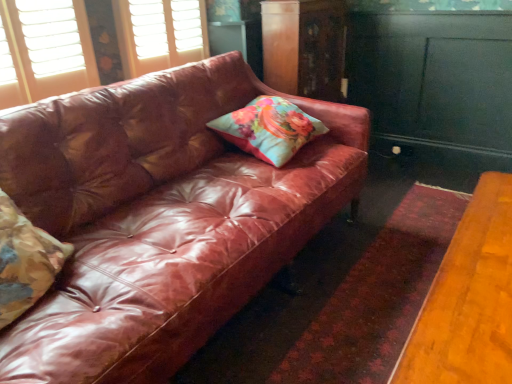
Question: Is floral fabric cushion at center, placed as the first pillow when sorted from top to bottom, surrounded by shiny brown leather couch at center?

Choices:
 (A) yes
 (B) no

Answer: (A)

Question: Considering the relative sizes of shiny brown leather couch at center and floral fabric cushion at center, acting as the 1th pillow starting from the back, in the image provided, is shiny brown leather couch at center thinner than floral fabric cushion at center, acting as the 1th pillow starting from the back,?

Choices:
 (A) no
 (B) yes

Answer: (A)

Question: Could you tell me if shiny brown leather couch at center is turned towards floral fabric cushion at center, placed as the 2th pillow when sorted from bottom to top?

Choices:
 (A) no
 (B) yes

Answer: (B)

Question: Can you confirm if shiny brown leather couch at center is positioned to the right of floral fabric cushion at center, placed as the 1th pillow when sorted from right to left?

Choices:
 (A) no
 (B) yes

Answer: (A)

Question: Is shiny brown leather couch at center not close to floral fabric cushion at center, acting as the 1th pillow starting from the back?

Choices:
 (A) yes
 (B) no

Answer: (B)

Question: Looking at their shapes, would you say wooden dresser at upper center, marked as the first dresser in a left-to-right arrangement, is wider or thinner than teal painted wood dresser at right, which is counted as the 1th dresser, starting from the right?

Choices:
 (A) wide
 (B) thin

Answer: (A)

Question: Considering the positions of point (321, 56) and point (415, 115), is point (321, 56) closer or farther from the camera than point (415, 115)?

Choices:
 (A) farther
 (B) closer

Answer: (B)

Question: Is wooden dresser at upper center, marked as the first dresser in a left-to-right arrangement, inside the boundaries of teal painted wood dresser at right, which is counted as the second dresser, starting from the left, or outside?

Choices:
 (A) inside
 (B) outside

Answer: (B)

Question: Looking at the image, does wooden dresser at upper center, placed as the second dresser when sorted from right to left, seem bigger or smaller compared to teal painted wood dresser at right, which is counted as the second dresser, starting from the left?

Choices:
 (A) small
 (B) big

Answer: (B)

Question: Considering the relative positions of shiny brown leather couch at center and floral fabric pillow at left, acting as the first pillow starting from the left, in the image provided, is shiny brown leather couch at center to the left or to the right of floral fabric pillow at left, acting as the first pillow starting from the left,?

Choices:
 (A) right
 (B) left

Answer: (A)

Question: Considering the positions of point (187, 261) and point (37, 279), is point (187, 261) closer or farther from the camera than point (37, 279)?

Choices:
 (A) farther
 (B) closer

Answer: (A)

Question: Is shiny brown leather couch at center spatially inside floral fabric pillow at left, the 2th pillow positioned from the top, or outside of it?

Choices:
 (A) inside
 (B) outside

Answer: (B)

Question: From a real-world perspective, relative to floral fabric pillow at left, acting as the first pillow starting from the left, is shiny brown leather couch at center vertically above or below?

Choices:
 (A) below
 (B) above

Answer: (A)

Question: Do you think shiny brown leather couch at center is within teal painted wood dresser at right, which is counted as the 1th dresser, starting from the right, or outside of it?

Choices:
 (A) inside
 (B) outside

Answer: (B)

Question: In terms of height, does shiny brown leather couch at center look taller or shorter compared to teal painted wood dresser at right, which is counted as the second dresser, starting from the left?

Choices:
 (A) short
 (B) tall

Answer: (A)